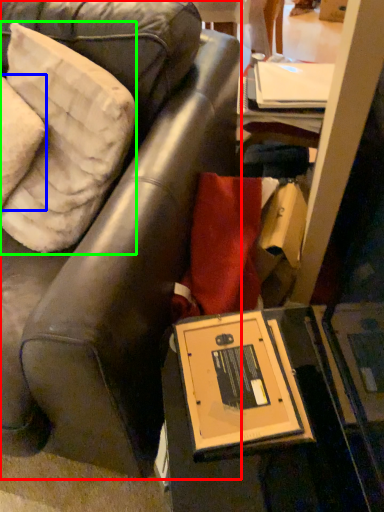
Question: Based on their relative distances, which object is nearer to chair (highlighted by a red box)? Choose from pillow (highlighted by a blue box) and pillow (highlighted by a green box).

Choices:
 (A) pillow
 (B) pillow

Answer: (B)